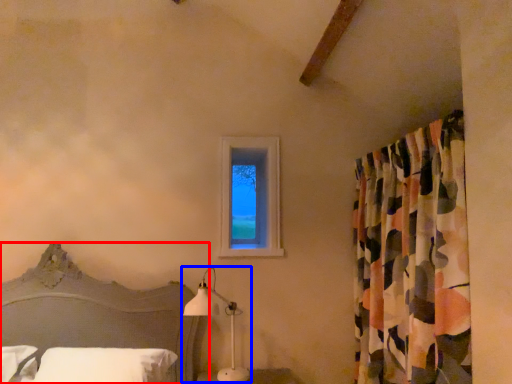
Question: Which object is closer to the camera taking this photo, bed (highlighted by a red box) or table lamp (highlighted by a blue box)?

Choices:
 (A) bed
 (B) table lamp

Answer: (A)